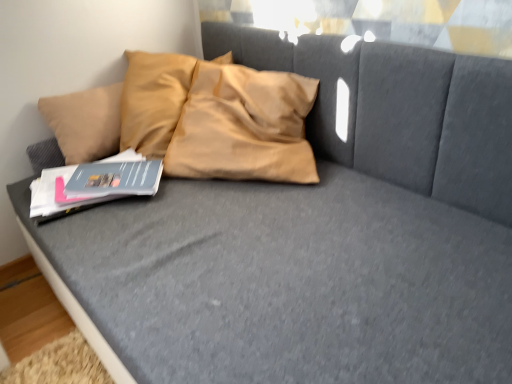
Question: Considering their positions, is matte blue paperback book at left, the first paperback book positioned from the front, located in front of or behind matte blue paperback book at center-left, marked as the 1th paperback book in a back-to-front arrangement?

Choices:
 (A) behind
 (B) front

Answer: (B)

Question: Is matte blue paperback book at left, arranged as the 2th paperback book when viewed from the back, spatially inside matte blue paperback book at center-left, marked as the 1th paperback book in a back-to-front arrangement, or outside of it?

Choices:
 (A) outside
 (B) inside

Answer: (A)

Question: From the image's perspective, is matte blue paperback book at left, the first paperback book positioned from the front, above or below matte blue paperback book at center-left, marked as the 1th paperback book in a back-to-front arrangement?

Choices:
 (A) above
 (B) below

Answer: (B)

Question: From their relative heights in the image, would you say matte blue paperback book at center-left, the second paperback book in the front-to-back sequence, is taller or shorter than matte blue paperback book at left, the first paperback book positioned from the front?

Choices:
 (A) tall
 (B) short

Answer: (B)

Question: In the image, is matte blue paperback book at center-left, the second paperback book in the front-to-back sequence, positioned in front of or behind matte blue paperback book at left, arranged as the 2th paperback book when viewed from the back?

Choices:
 (A) front
 (B) behind

Answer: (B)

Question: From the image's perspective, is matte blue paperback book at center-left, marked as the 1th paperback book in a back-to-front arrangement, located above or below matte blue paperback book at left, the first paperback book positioned from the front?

Choices:
 (A) above
 (B) below

Answer: (A)

Question: From a real-world perspective, is matte blue paperback book at center-left, the second paperback book in the front-to-back sequence, above or below matte blue paperback book at left, the first paperback book positioned from the front?

Choices:
 (A) below
 (B) above

Answer: (B)